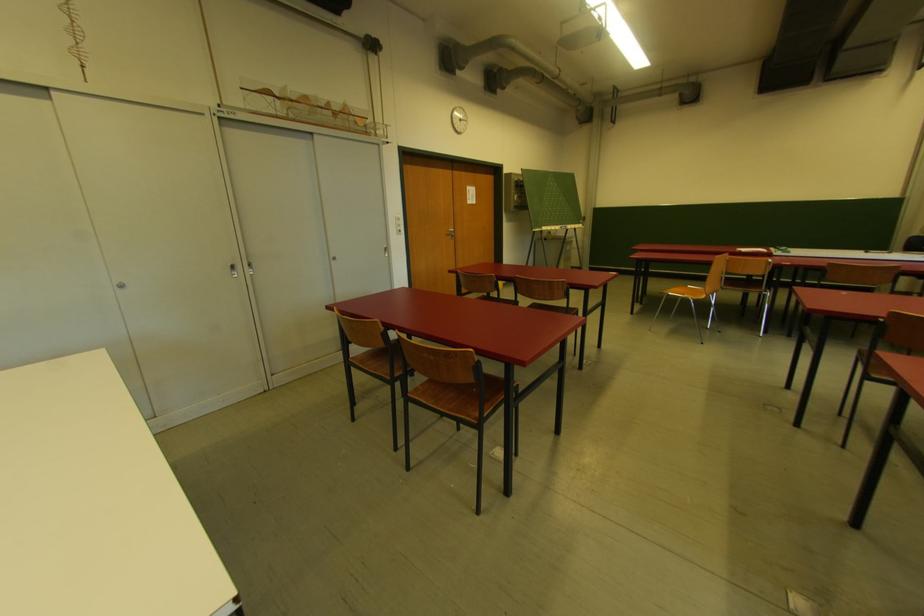
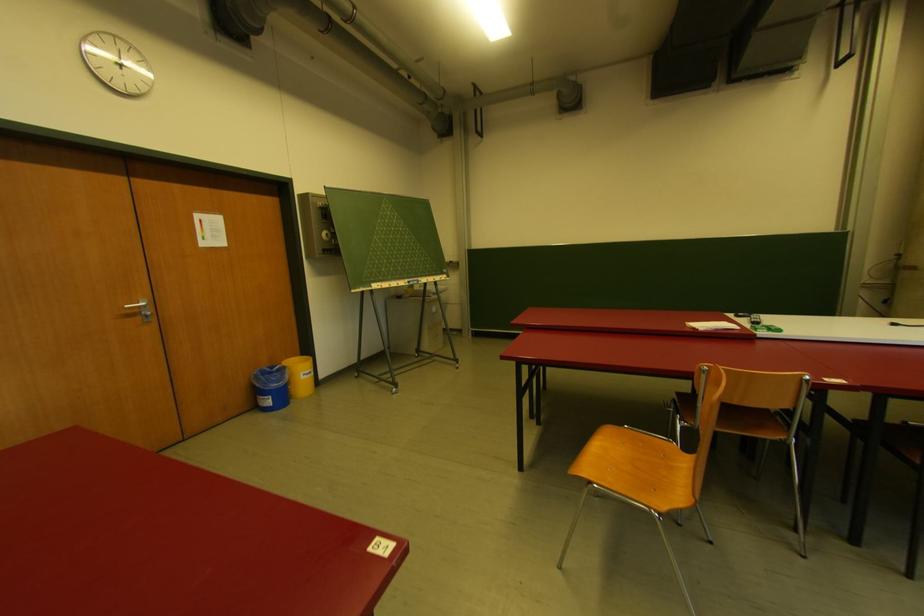
Which direction would the cameraman need to move to produce the second image?

The cameraman walked toward right, forward.